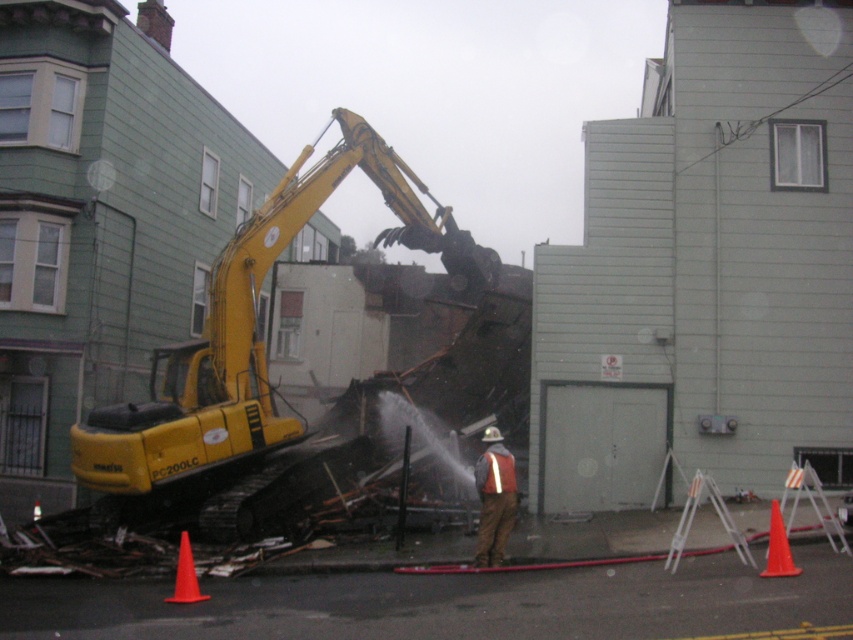
Question: Considering the relative positions of yellow metallic excavator at center and reflective fabric safety vest at center in the image provided, where is yellow metallic excavator at center located with respect to reflective fabric safety vest at center?

Choices:
 (A) right
 (B) left

Answer: (B)

Question: Which point is farther to the camera?

Choices:
 (A) (502, 474)
 (B) (779, 556)

Answer: (A)

Question: Is orange matte traffic cone at lower right positioned in front of orange matte traffic cone at lower left?

Choices:
 (A) no
 (B) yes

Answer: (B)

Question: Estimate the real-world distances between objects in this image. Which object is closer to the orange matte traffic cone at lower left?

Choices:
 (A) reflective orange vest at center
 (B) yellow metallic excavator at center
 (C) reflective fabric safety vest at center
 (D) orange matte traffic cone at lower right

Answer: (A)

Question: Is reflective orange vest at center to the left of reflective fabric safety vest at center from the viewer's perspective?

Choices:
 (A) yes
 (B) no

Answer: (A)

Question: Which of the following is the farthest from the observer?

Choices:
 (A) (779, 513)
 (B) (509, 484)
 (C) (184, 577)
 (D) (492, 428)

Answer: (D)